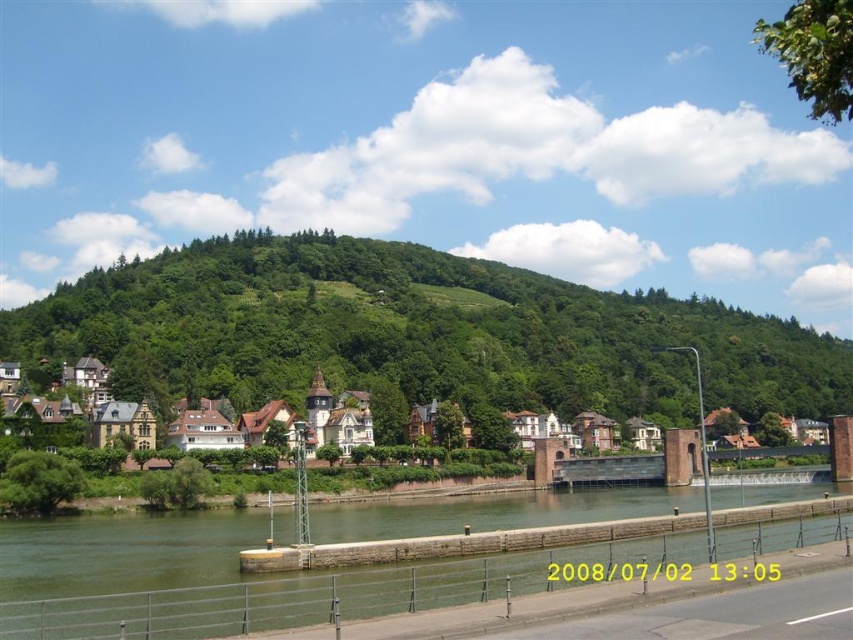
Question: In this image, where is green leafy hillside at center located relative to green concrete river at lower center?

Choices:
 (A) above
 (B) below

Answer: (A)

Question: Which point is farther to the camera?

Choices:
 (A) white wooden houses at left
 (B) green leafy hillside at center
 (C) green concrete river at lower center

Answer: (B)

Question: Which of the following is the farthest from the observer?

Choices:
 (A) green concrete river at lower center
 (B) white wooden houses at left

Answer: (B)

Question: Which object appears closest to the camera in this image?

Choices:
 (A) green concrete river at lower center
 (B) white wooden houses at left

Answer: (A)

Question: Where is green leafy hillside at center located in relation to white wooden houses at left in the image?

Choices:
 (A) below
 (B) above

Answer: (B)

Question: Is green concrete river at lower center below white wooden houses at left?

Choices:
 (A) yes
 (B) no

Answer: (A)